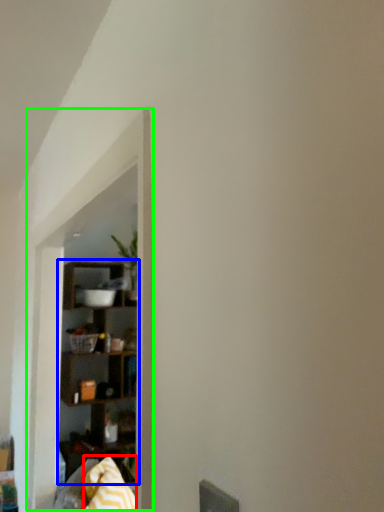
Question: Which object is positioned closest to blanket (highlighted by a red box)? Select from shelf (highlighted by a blue box) and window sill (highlighted by a green box).

Choices:
 (A) shelf
 (B) window sill

Answer: (B)